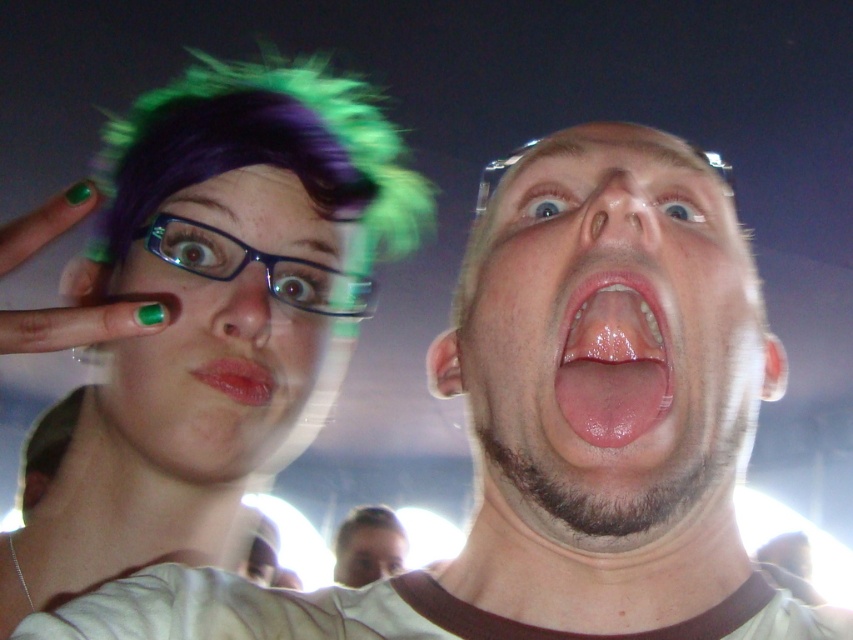
How distant is matte blue glasses at upper left from pink glossy tongue at center?

The distance of matte blue glasses at upper left from pink glossy tongue at center is 25.96 centimeters.

Between point (271, 276) and point (666, 404), which one is positioned in front?

Point (666, 404)

You are a GUI agent. You are given a task and a screenshot of the screen. Output one action in this format:
    pyautogui.click(x=<x>, y=<y>)
    Task: Click on the matte blue glasses at upper left
    This screenshot has width=853, height=640.
    Given the screenshot: What is the action you would take?
    pyautogui.click(x=219, y=326)

Consider the image. Is pink glossy tongue at center shorter than smooth matte lips at center?

Incorrect, pink glossy tongue at center's height does not fall short of smooth matte lips at center's.

Is pink glossy tongue at center further to camera compared to smooth matte lips at center?

No, pink glossy tongue at center is closer to the viewer.

Locate an element on the screen. This screenshot has width=853, height=640. pink glossy tongue at center is located at coordinates (613, 358).

Is pink glossy tongue at center positioned at the back of smooth skin face at center?

That is False.

Is pink glossy tongue at center above smooth skin face at center?

Yes.

Is point (637, 380) closer to camera compared to point (334, 566)?

Yes, it is.

At what (x,y) coordinates should I click in order to perform the action: click on pink glossy tongue at center. Please return your answer as a coordinate pair (x, y). The width and height of the screenshot is (853, 640). Looking at the image, I should click on (613, 358).